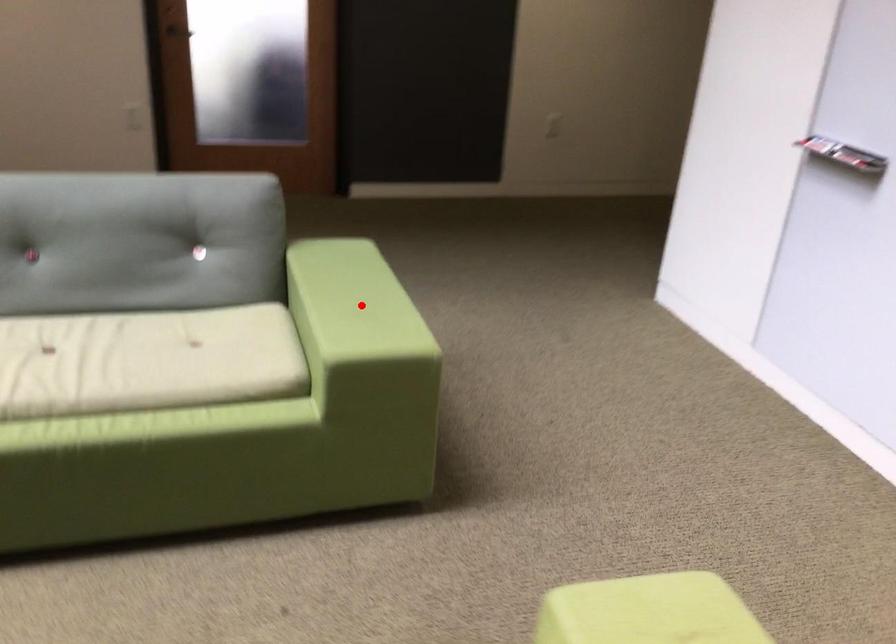
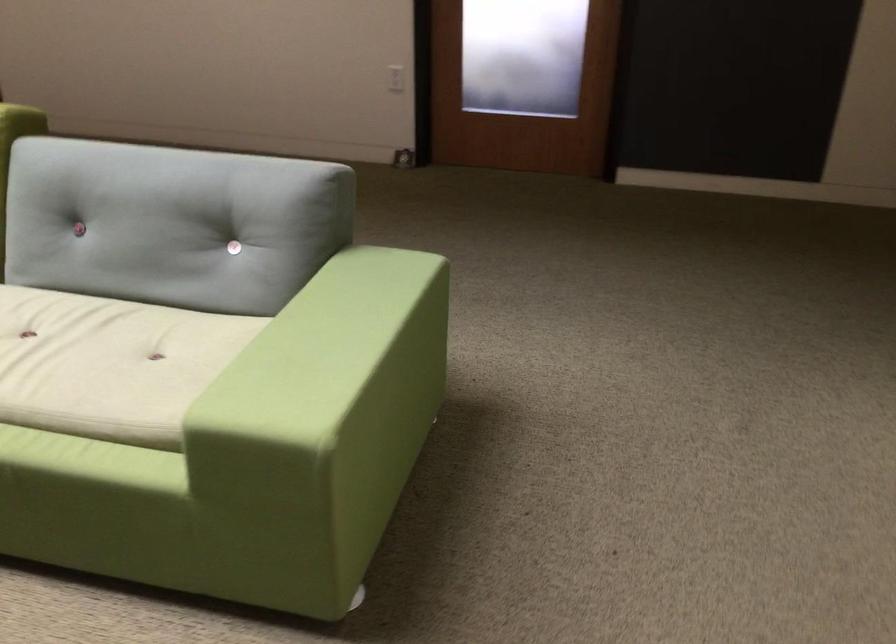
Question: I am providing you with two images of the same scene from different viewpoints. Image1 has a red point marked. In image2, the corresponding 3D location appears at what relative position? Reply with the corresponding letter.

Choices:
 (A) Closer
 (B) Farther

Answer: (A)